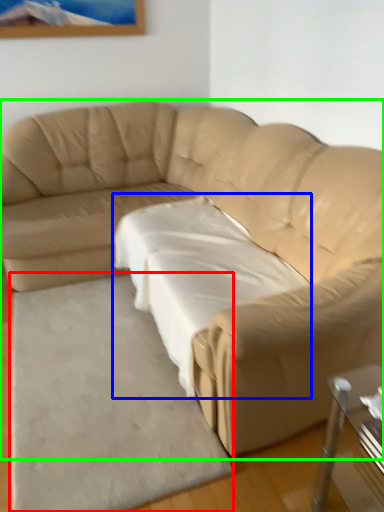
Question: Based on their relative distances, which object is farther from mat (highlighted by a red box)? Choose from sheet (highlighted by a blue box) and studio couch (highlighted by a green box).

Choices:
 (A) sheet
 (B) studio couch

Answer: (B)